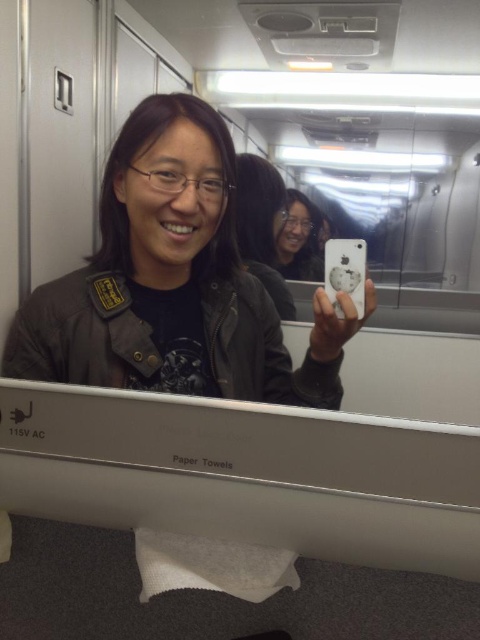
Question: Does matte black jacket at center have a larger size compared to matte black phone at center?

Choices:
 (A) no
 (B) yes

Answer: (B)

Question: Can you confirm if matte black jacket at center is positioned below matte black phone at center?

Choices:
 (A) no
 (B) yes

Answer: (B)

Question: Which object appears closest to the camera in this image?

Choices:
 (A) matte black jacket at center
 (B) matte black phone at center

Answer: (A)

Question: Which point appears farthest from the camera in this image?

Choices:
 (A) (195, 310)
 (B) (302, 250)

Answer: (A)

Question: Is matte black jacket at center smaller than matte black phone at center?

Choices:
 (A) yes
 (B) no

Answer: (B)